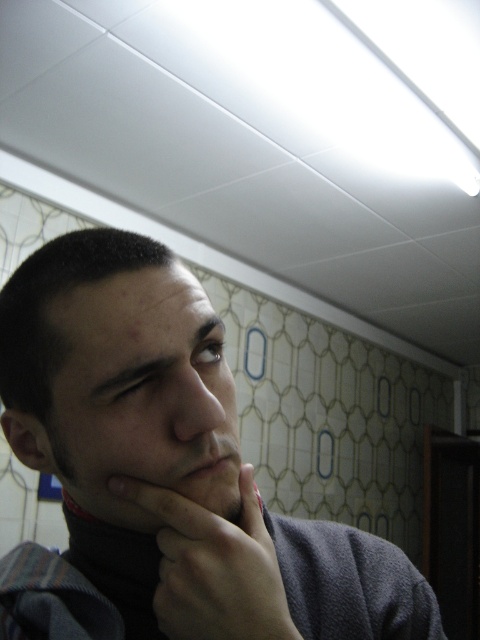
Question: Estimate the real-world distances between objects in this image. Which object is closer to the smooth skin nose at center?

Choices:
 (A) matte skin at center
 (B) smooth skin face at center
 (C) smooth skin hand at center

Answer: (A)

Question: Estimate the real-world distances between objects in this image. Which object is closer to the smooth skin nose at center?

Choices:
 (A) smooth skin hand at center
 (B) gray matte turtleneck at center

Answer: (A)

Question: Which of the following is the closest to the observer?

Choices:
 (A) (112, 412)
 (B) (235, 410)
 (C) (166, 568)
 (D) (206, 468)

Answer: (A)

Question: Considering the relative positions of smooth skin face at center and smooth skin hand at center in the image provided, where is smooth skin face at center located with respect to smooth skin hand at center?

Choices:
 (A) below
 (B) above

Answer: (B)

Question: Is smooth skin face at center positioned in front of smooth skin nose at center?

Choices:
 (A) yes
 (B) no

Answer: (A)

Question: Can you confirm if smooth skin hand at center is smaller than smooth skin nose at center?

Choices:
 (A) no
 (B) yes

Answer: (A)